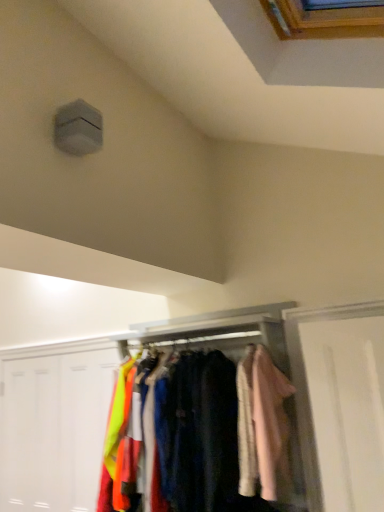
The height and width of the screenshot is (512, 384). In order to click on neon yellow fabric at lower left, placed as the first door when sorted from right to left in this screenshot , I will do `click(85, 419)`.

Identify the location of neon yellow fabric at lower left, placed as the first door when sorted from right to left. (85, 419).

I want to click on door that is the 2nd one when counting leftward from the light pink fabric coat at right, so click(54, 429).

Is white matte door at lower left, arranged as the 1th door when viewed from the left, oriented away from light pink fabric coat at right?

No, light pink fabric coat at right is not at the back of white matte door at lower left, arranged as the 1th door when viewed from the left.

Is white matte door at lower left, which is the second door in right-to-left order, closer to camera compared to light pink fabric coat at right?

No, white matte door at lower left, which is the second door in right-to-left order, is behind light pink fabric coat at right.

In the scene shown: Can you confirm if neon yellow fabric at lower left, marked as the second door in a left-to-right arrangement, is positioned to the left of light pink fabric coat at right?

Yes.

Is neon yellow fabric at lower left, marked as the second door in a left-to-right arrangement, not close to light pink fabric coat at right?

neon yellow fabric at lower left, marked as the second door in a left-to-right arrangement, is positioned a significant distance from light pink fabric coat at right.

Would you say light pink fabric coat at right is part of neon yellow fabric at lower left, placed as the first door when sorted from right to left,'s contents?

No.

Is velvet fabric shirts at center next to white matte door at lower left, arranged as the 1th door when viewed from the left?

No, velvet fabric shirts at center is not in contact with white matte door at lower left, arranged as the 1th door when viewed from the left.

Is velvet fabric shirts at center to the left or to the right of white matte door at lower left, which is the second door in right-to-left order, in the image?

Clearly, velvet fabric shirts at center is on the right of white matte door at lower left, which is the second door in right-to-left order, in the image.

Which is correct: velvet fabric shirts at center is inside white matte door at lower left, arranged as the 1th door when viewed from the left, or outside of it?

velvet fabric shirts at center is located beyond the bounds of white matte door at lower left, arranged as the 1th door when viewed from the left.

From the image's perspective, is velvet fabric shirts at center on white matte door at lower left, which is the second door in right-to-left order?

Yes, from the image's perspective, velvet fabric shirts at center is above white matte door at lower left, which is the second door in right-to-left order.

Consider the image. From a real-world perspective, who is located higher, light pink fabric coat at right or velvet fabric shirts at center?

light pink fabric coat at right.

Which point is more distant from viewer, (271, 392) or (206, 473)?

The point (271, 392) is farther.

From the image's perspective, between light pink fabric coat at right and velvet fabric shirts at center, which one is located above?

light pink fabric coat at right is shown above in the image.

Is neon yellow fabric at lower left, placed as the first door when sorted from right to left, positioned with its back to white matte door at lower left, which is the second door in right-to-left order?

Correct, neon yellow fabric at lower left, placed as the first door when sorted from right to left, is looking away from white matte door at lower left, which is the second door in right-to-left order.

In the scene shown: Is neon yellow fabric at lower left, marked as the second door in a left-to-right arrangement, smaller than white matte door at lower left, arranged as the 1th door when viewed from the left?

Correct, neon yellow fabric at lower left, marked as the second door in a left-to-right arrangement, occupies less space than white matte door at lower left, arranged as the 1th door when viewed from the left.

Which point is more distant from viewer, (76, 418) or (101, 435)?

The point (76, 418) is farther.

Considering the sizes of objects neon yellow fabric at lower left, marked as the second door in a left-to-right arrangement, and white matte door at lower left, arranged as the 1th door when viewed from the left, in the image provided, who is taller, neon yellow fabric at lower left, marked as the second door in a left-to-right arrangement, or white matte door at lower left, arranged as the 1th door when viewed from the left,?

white matte door at lower left, arranged as the 1th door when viewed from the left.

In terms of height, does velvet fabric shirts at center look taller or shorter compared to light pink fabric coat at right?

Clearly, velvet fabric shirts at center is taller compared to light pink fabric coat at right.

Is velvet fabric shirts at center oriented away from light pink fabric coat at right?

No, velvet fabric shirts at center's orientation is not away from light pink fabric coat at right.

From the picture: Which of these two, velvet fabric shirts at center or light pink fabric coat at right, is smaller?

light pink fabric coat at right is smaller.

From a real-world perspective, is velvet fabric shirts at center physically located above or below light pink fabric coat at right?

From a real-world perspective, velvet fabric shirts at center is physically below light pink fabric coat at right.

Does neon yellow fabric at lower left, placed as the first door when sorted from right to left, have a greater width compared to velvet fabric shirts at center?

No.

Does point (76, 362) lie behind point (180, 469)?

Yes, point (76, 362) is farther from viewer.

Considering the relative positions of neon yellow fabric at lower left, marked as the second door in a left-to-right arrangement, and velvet fabric shirts at center in the image provided, is neon yellow fabric at lower left, marked as the second door in a left-to-right arrangement, to the left or to the right of velvet fabric shirts at center?

Clearly, neon yellow fabric at lower left, marked as the second door in a left-to-right arrangement, is on the left of velvet fabric shirts at center in the image.

Is neon yellow fabric at lower left, marked as the second door in a left-to-right arrangement, touching velvet fabric shirts at center?

There is a gap between neon yellow fabric at lower left, marked as the second door in a left-to-right arrangement, and velvet fabric shirts at center.

The height and width of the screenshot is (512, 384). Identify the location of clothing lying above the white matte door at lower left, which is the second door in right-to-left order (from the image's perspective). (262, 425).

This screenshot has width=384, height=512. I want to click on clothing located in front of the neon yellow fabric at lower left, placed as the first door when sorted from right to left, so click(x=262, y=425).

Which object lies further to the anchor point neon yellow fabric at lower left, placed as the first door when sorted from right to left, light pink fabric coat at right or velvet fabric shirts at center?

light pink fabric coat at right is further to neon yellow fabric at lower left, placed as the first door when sorted from right to left.

Based on their spatial positions, is neon yellow fabric at lower left, placed as the first door when sorted from right to left, or white matte door at lower left, arranged as the 1th door when viewed from the left, closer to velvet fabric shirts at center?

neon yellow fabric at lower left, placed as the first door when sorted from right to left, is closer to velvet fabric shirts at center.

Looking at this image, which object lies further to the anchor point light pink fabric coat at right, velvet fabric shirts at center or neon yellow fabric at lower left, placed as the first door when sorted from right to left?

The object further to light pink fabric coat at right is neon yellow fabric at lower left, placed as the first door when sorted from right to left.

Which object lies further to the anchor point neon yellow fabric at lower left, marked as the second door in a left-to-right arrangement, velvet fabric shirts at center or light pink fabric coat at right?

The object further to neon yellow fabric at lower left, marked as the second door in a left-to-right arrangement, is light pink fabric coat at right.

From the image, which object appears to be nearer to white matte door at lower left, arranged as the 1th door when viewed from the left, velvet fabric shirts at center or neon yellow fabric at lower left, placed as the first door when sorted from right to left?

neon yellow fabric at lower left, placed as the first door when sorted from right to left, is closer to white matte door at lower left, arranged as the 1th door when viewed from the left.

Which object lies further to the anchor point white matte door at lower left, which is the second door in right-to-left order, light pink fabric coat at right or velvet fabric shirts at center?

light pink fabric coat at right lies further to white matte door at lower left, which is the second door in right-to-left order, than the other object.

Which object lies further to the anchor point light pink fabric coat at right, velvet fabric shirts at center or white matte door at lower left, arranged as the 1th door when viewed from the left?

white matte door at lower left, arranged as the 1th door when viewed from the left, lies further to light pink fabric coat at right than the other object.

Looking at the image, which one is located further to light pink fabric coat at right, white matte door at lower left, which is the second door in right-to-left order, or velvet fabric shirts at center?

Based on the image, white matte door at lower left, which is the second door in right-to-left order, appears to be further to light pink fabric coat at right.

Where is `door positioned between velvet fabric shirts at center and neon yellow fabric at lower left, marked as the second door in a left-to-right arrangement, from near to far`? door positioned between velvet fabric shirts at center and neon yellow fabric at lower left, marked as the second door in a left-to-right arrangement, from near to far is located at coordinates (54, 429).

Identify the location of garment between white matte door at lower left, arranged as the 1th door when viewed from the left, and light pink fabric coat at right, in the horizontal direction. This screenshot has height=512, width=384. (199, 433).

The image size is (384, 512). What are the coordinates of `garment situated between neon yellow fabric at lower left, placed as the first door when sorted from right to left, and light pink fabric coat at right from left to right` in the screenshot? It's located at (199, 433).

Image resolution: width=384 pixels, height=512 pixels. Identify the location of door located between white matte door at lower left, arranged as the 1th door when viewed from the left, and light pink fabric coat at right in the left-right direction. (85, 419).